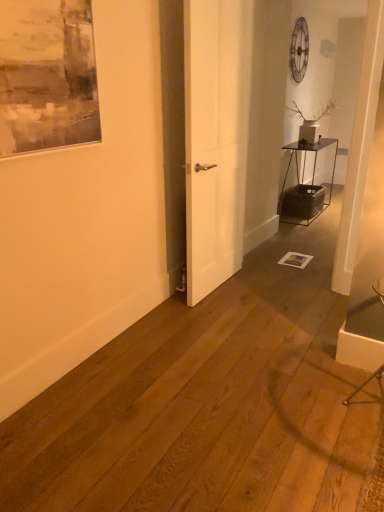
In order to face metallic silver armchair at lower right, should I rotate leftwards or rightwards?

Rotate right and turn 23.767 degrees.

What do you see at coordinates (47, 75) in the screenshot? I see `matte gray painting at upper left` at bounding box center [47, 75].

Locate an element on the screen. The height and width of the screenshot is (512, 384). metallic black table at right is located at coordinates [304, 187].

Does white matte door at center have a lesser height compared to metallic black table at right?

No.

Is white matte door at center next to metallic black table at right?

white matte door at center and metallic black table at right are clearly separated.

Find the location of a particular element. This screenshot has height=512, width=384. table behind the white matte door at center is located at coordinates (304, 187).

Who is smaller, white matte door at center or metallic black table at right?

white matte door at center is smaller.

Is metallic silver armchair at lower right far from metallic black table at right?

Yes, metallic silver armchair at lower right and metallic black table at right are located far from each other.

What's the angular difference between metallic silver armchair at lower right and metallic black table at right's facing directions?

92.3 degrees separate the facing orientations of metallic silver armchair at lower right and metallic black table at right.

Which of these two, metallic silver armchair at lower right or metallic black table at right, is wider?

Wider between the two is metallic silver armchair at lower right.

Relative to metallic black table at right, is metallic silver armchair at lower right in front or behind?

metallic silver armchair at lower right is positioned closer to the viewer than metallic black table at right.

Does metallic silver armchair at lower right come in front of matte gray painting at upper left?

No, the depth of metallic silver armchair at lower right is greater than that of matte gray painting at upper left.

From the picture: Which object is wider, metallic silver armchair at lower right or matte gray painting at upper left?

metallic silver armchair at lower right is wider.

The width and height of the screenshot is (384, 512). Identify the location of armchair located below the matte gray painting at upper left (from the image's perspective). (364, 384).

Between matte gray painting at upper left and metallic silver armchair at lower right, which one has larger width?

Wider between the two is metallic silver armchair at lower right.

Is metallic silver armchair at lower right a part of matte gray painting at upper left?

No, metallic silver armchair at lower right is not inside matte gray painting at upper left.

Which is behind, matte gray painting at upper left or metallic silver armchair at lower right?

metallic silver armchair at lower right is further from the camera.

I want to click on door lying below the metallic black table at right (from the image's perspective), so click(215, 139).

Which of these two, metallic black table at right or white matte door at center, is thinner?

Thinner between the two is white matte door at center.

Is metallic black table at right bigger than white matte door at center?

Yes.

From the picture: From a real-world perspective, between metallic black table at right and white matte door at center, who is vertically lower?

metallic black table at right.

Considering the sizes of matte gray painting at upper left and white matte door at center in the image, is matte gray painting at upper left taller or shorter than white matte door at center?

Clearly, matte gray painting at upper left is shorter compared to white matte door at center.

Is white matte door at center at the back of matte gray painting at upper left?

No.

From a real-world perspective, who is located lower, matte gray painting at upper left or white matte door at center?

white matte door at center.

Considering their positions, is matte gray painting at upper left located in front of or behind white matte door at center?

matte gray painting at upper left is in front of white matte door at center.

Which object is thinner, white matte door at center or metallic silver armchair at lower right?

With smaller width is white matte door at center.

From a real-world perspective, between white matte door at center and metallic silver armchair at lower right, who is vertically higher?

From a 3D spatial view, white matte door at center is above.

Measure the distance between white matte door at center and metallic silver armchair at lower right.

white matte door at center is 1.53 meters away from metallic silver armchair at lower right.

This screenshot has height=512, width=384. Identify the location of table directly beneath the white matte door at center (from a real-world perspective). (x=304, y=187).

Image resolution: width=384 pixels, height=512 pixels. What are the coordinates of `table on the right of metallic silver armchair at lower right` in the screenshot? It's located at (304, 187).

From the image, which object appears to be farther from matte gray painting at upper left, metallic black table at right or metallic silver armchair at lower right?

metallic black table at right is further to matte gray painting at upper left.

Estimate the real-world distances between objects in this image. Which object is further from metallic silver armchair at lower right, white matte door at center or matte gray painting at upper left?

Based on the image, matte gray painting at upper left appears to be further to metallic silver armchair at lower right.

When comparing their distances from metallic black table at right, does matte gray painting at upper left or metallic silver armchair at lower right seem closer?

metallic silver armchair at lower right.

Estimate the real-world distances between objects in this image. Which object is closer to metallic black table at right, metallic silver armchair at lower right or white matte door at center?

white matte door at center lies closer to metallic black table at right than the other object.

Looking at the image, which one is located further to metallic silver armchair at lower right, matte gray painting at upper left or white matte door at center?

Among the two, matte gray painting at upper left is located further to metallic silver armchair at lower right.

In the scene shown: Considering their positions, is metallic silver armchair at lower right positioned further to white matte door at center than matte gray painting at upper left?

metallic silver armchair at lower right is further to white matte door at center.

Looking at the image, which one is located further to matte gray painting at upper left, white matte door at center or metallic black table at right?

metallic black table at right.

Based on their spatial positions, is matte gray painting at upper left or metallic black table at right further from metallic silver armchair at lower right?

Among the two, metallic black table at right is located further to metallic silver armchair at lower right.

I want to click on door between matte gray painting at upper left and metallic black table at right from front to back, so click(x=215, y=139).

The image size is (384, 512). I want to click on armchair positioned between matte gray painting at upper left and metallic black table at right from near to far, so click(364, 384).

Where is `door between matte gray painting at upper left and metallic silver armchair at lower right in the horizontal direction`? The image size is (384, 512). door between matte gray painting at upper left and metallic silver armchair at lower right in the horizontal direction is located at coordinates (215, 139).

You are a GUI agent. You are given a task and a screenshot of the screen. Output one action in this format:
    pyautogui.click(x=<x>, y=<y>)
    Task: Click on the door located between metallic silver armchair at lower right and metallic black table at right in the depth direction
    This screenshot has width=384, height=512.
    Given the screenshot: What is the action you would take?
    pyautogui.click(x=215, y=139)